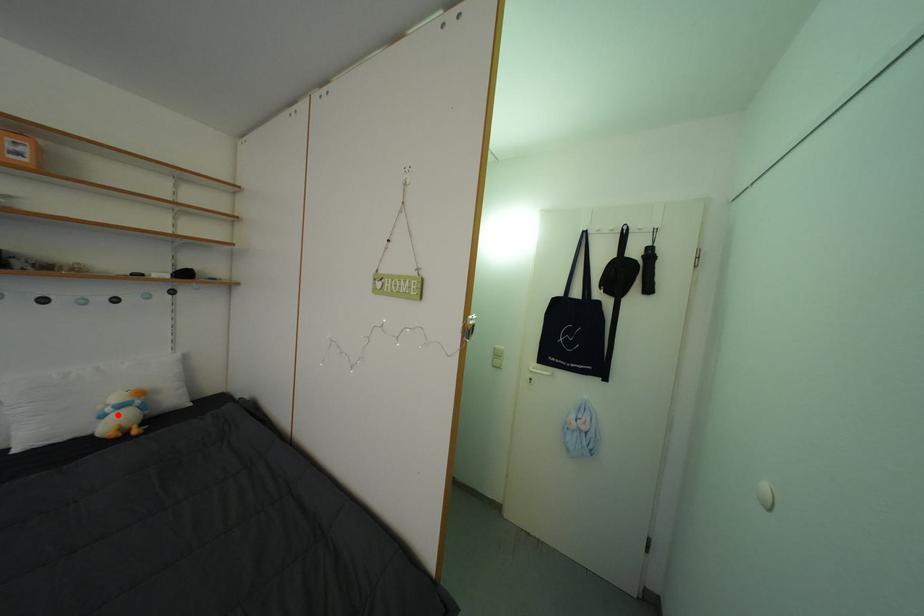
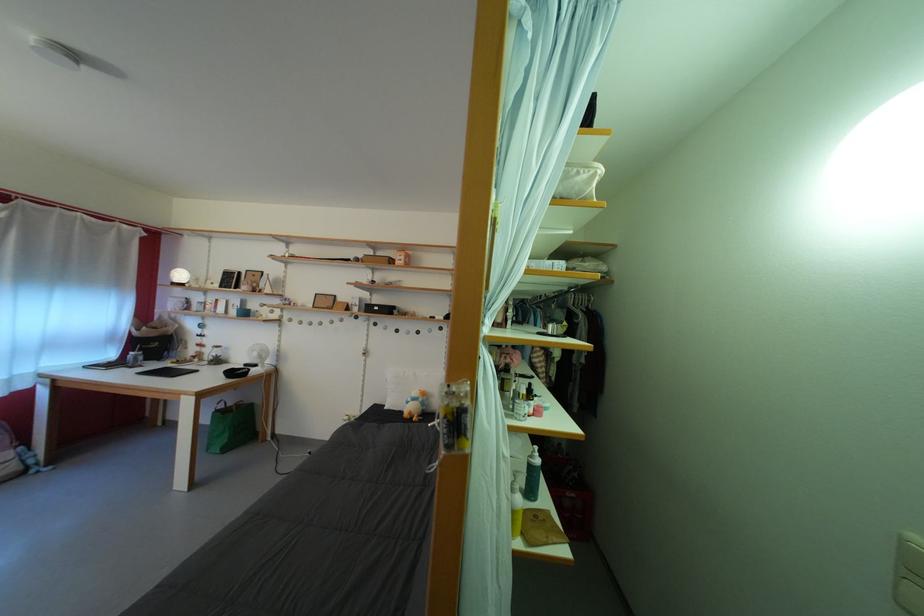
Question: I am providing you with two images of the same scene from different viewpoints. Given a red point in image1, look at the same physical point in image2. Is it:

Choices:
 (A) Closer to the viewpoint
 (B) Farther from the viewpoint

Answer: (B)